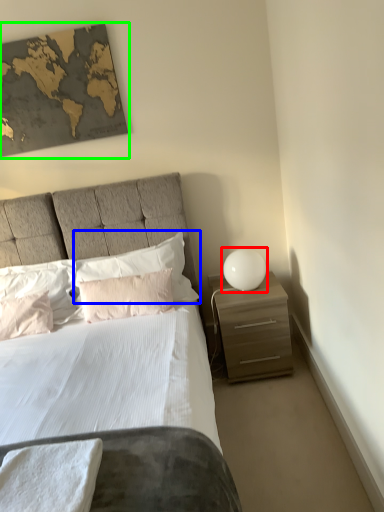
Question: Considering the real-world distances, which object is farthest from table lamp (highlighted by a red box)? pillow (highlighted by a blue box) or picture frame (highlighted by a green box)?

Choices:
 (A) pillow
 (B) picture frame

Answer: (B)